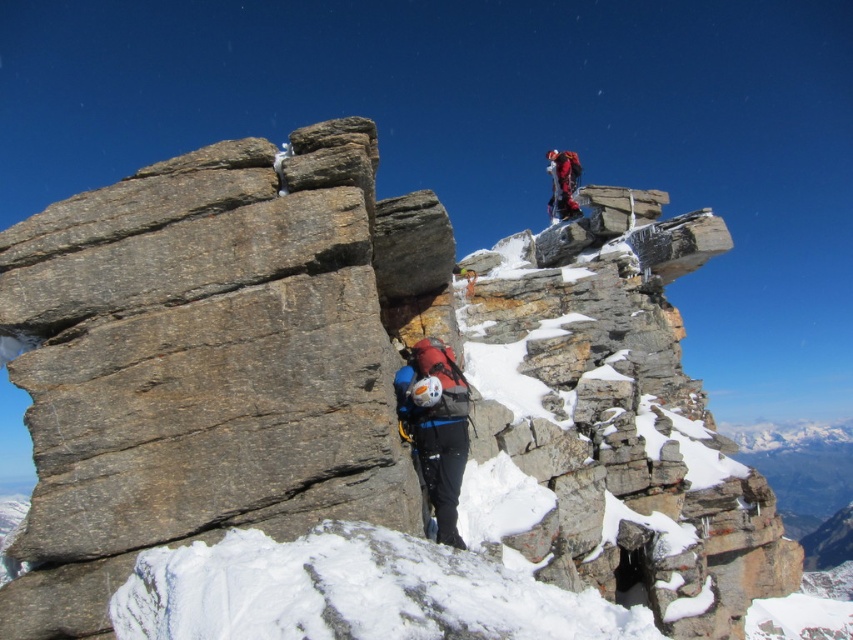
You are a mountain guide assessing the climbing route. You see the matte blue helmet at center and the red fabric jacket at upper center. Which climber is closer to the summit? Please explain based on their positions.

The red fabric jacket at upper center is closer to the summit because it is positioned higher up than the matte blue helmet at center.

You are a climber planning to reach the summit. You have a rope that is 50 meters long. There is a crucial point marked at point (468, 449) that you need to reach. Can you safely use your rope to reach that point from your current position?

The point at (468, 449) is 51.34 meters away from the viewer. Since the rope is only 50 meters long, it is not long enough to safely reach that point.

You are a mountain guide assessing the climbing route. You notice the matte blue helmet at center and the red fabric jacket at upper center. Which object is positioned lower in the scene?

The matte blue helmet at center has a lesser height compared to the red fabric jacket at upper center, so the matte blue helmet at center is positioned lower in the scene.